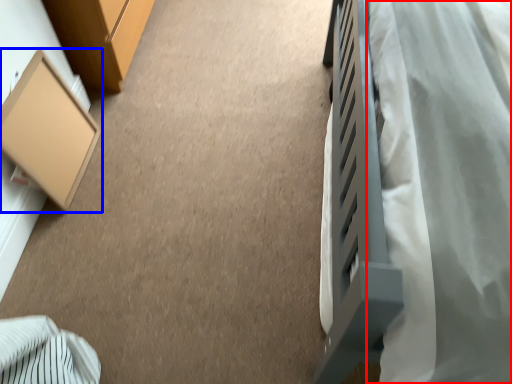
Question: Among these objects, which one is farthest to the camera, blanket (highlighted by a red box) or furniture (highlighted by a blue box)?

Choices:
 (A) blanket
 (B) furniture

Answer: (B)